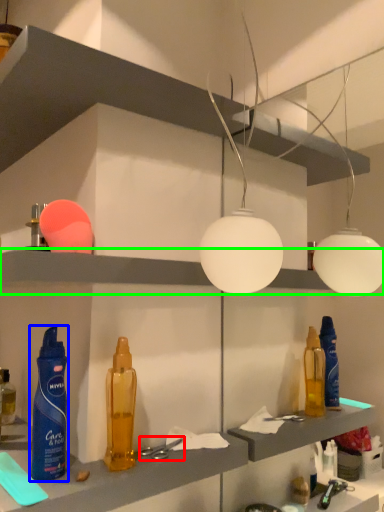
Question: Estimate the real-world distances between objects in this image. Which object is farther from tool (highlighted by a red box), bottle (highlighted by a blue box) or shelf (highlighted by a green box)?

Choices:
 (A) bottle
 (B) shelf

Answer: (B)